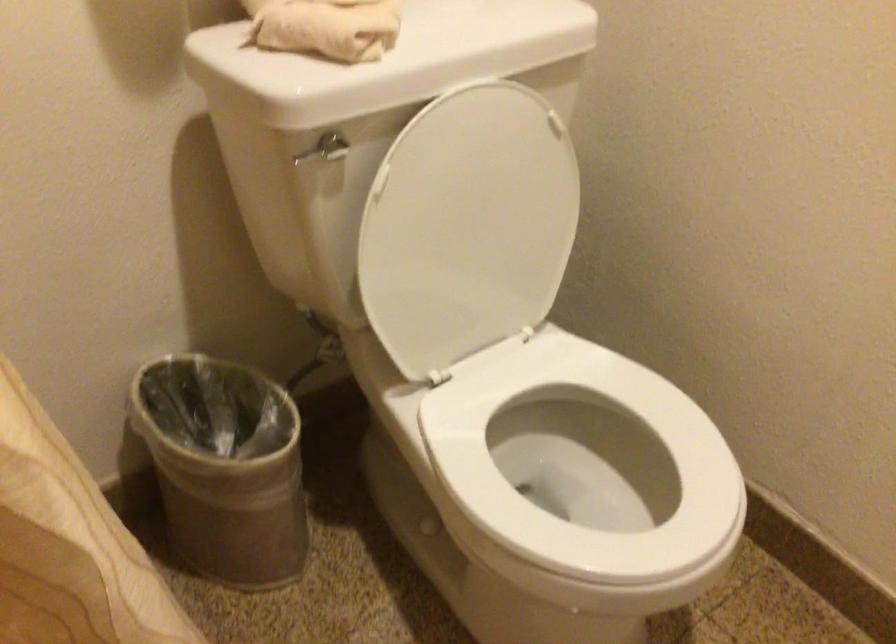
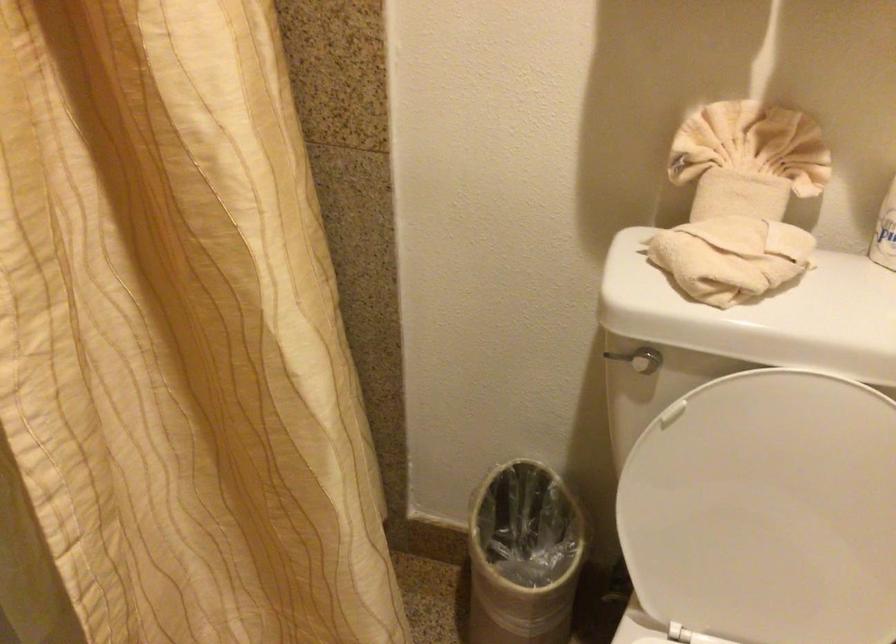
In the second image, find the point that corresponds to the point at 303,156 in the first image.

(616, 357)